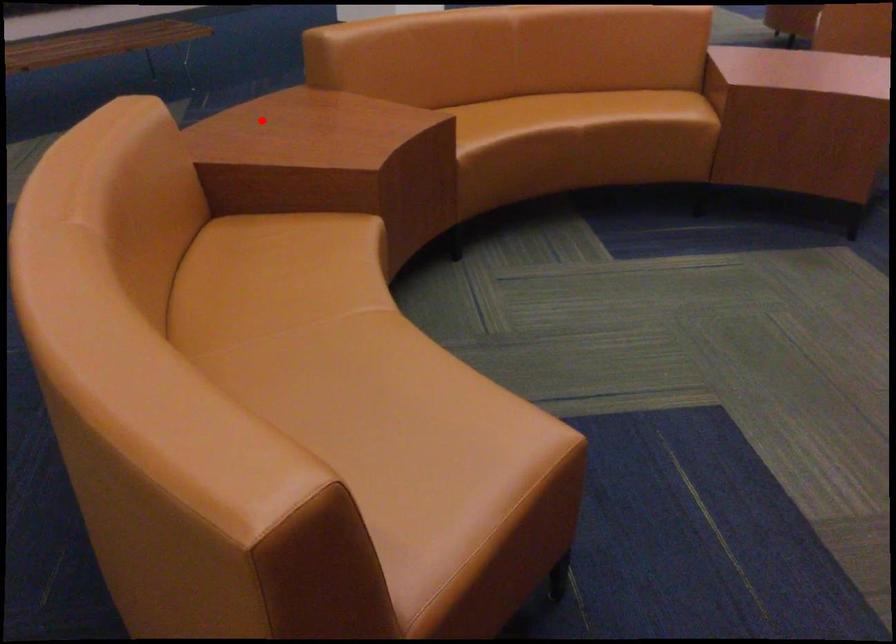
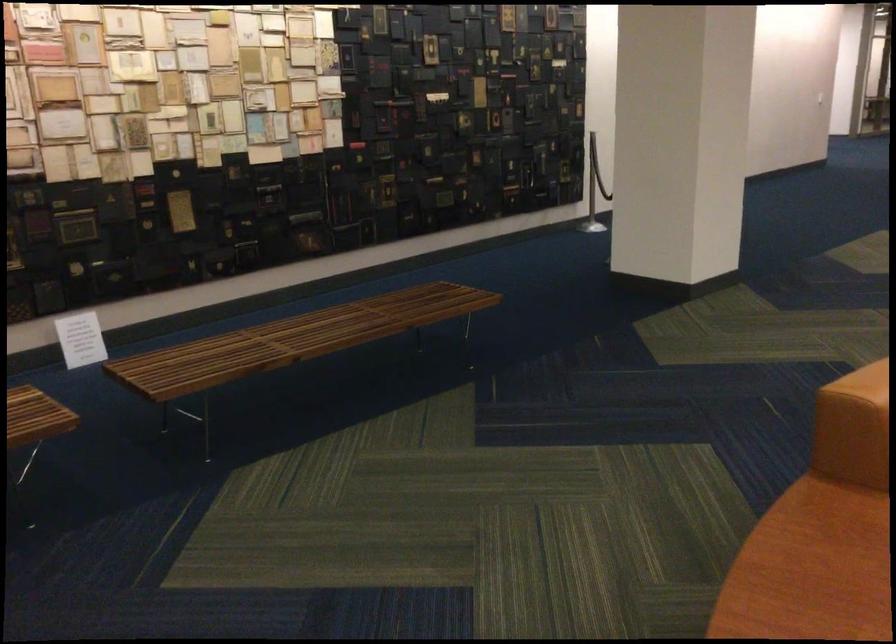
The point at the highlighted location is marked in the first image. Where is the corresponding point in the second image?

(808, 570)